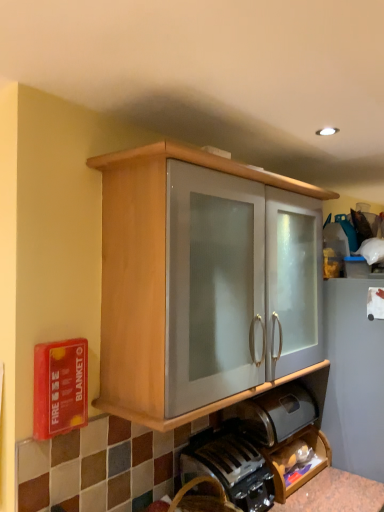
In order to face wooden shelf at lower right, should I rotate leftwards or rightwards?

Rotate right and turn 12.370 degrees.

Locate an element on the screen. Image resolution: width=384 pixels, height=512 pixels. wooden cabinet at center is located at coordinates (148, 278).

Is the position of wooden shelf at lower right more distant than that of black plastic coffee machine at lower center?

Yes, it is.

Considering the sizes of wooden shelf at lower right and black plastic coffee machine at lower center in the image, is wooden shelf at lower right taller or shorter than black plastic coffee machine at lower center?

wooden shelf at lower right is shorter than black plastic coffee machine at lower center.

Looking at their sizes, would you say wooden shelf at lower right is wider or thinner than black plastic coffee machine at lower center?

In the image, wooden shelf at lower right appears to be more narrow than black plastic coffee machine at lower center.

Consider the image. From the image's perspective, is wooden shelf at lower right over black plastic coffee machine at lower center?

No, from the image's perspective, wooden shelf at lower right is not over black plastic coffee machine at lower center.

From the image's perspective, is satin silver bread bin at lower center under wooden shelf at lower right?

No, from the image's perspective, satin silver bread bin at lower center is not below wooden shelf at lower right.

Does satin silver bread bin at lower center have a greater width compared to wooden shelf at lower right?

Yes.

Would you consider satin silver bread bin at lower center to be distant from wooden shelf at lower right?

No, satin silver bread bin at lower center is not far away from wooden shelf at lower right.

Does black plastic coffee machine at lower center lie behind satin silver bread bin at lower center?

No.

Considering the positions of point (195, 458) and point (264, 426), is point (195, 458) closer or farther from the camera than point (264, 426)?

Clearly, point (195, 458) is closer to the camera than point (264, 426).

How different are the orientations of wooden shelf at lower right and wooden cabinet at center in degrees?

0.513 degrees.

Considering the points (322, 441) and (130, 234), which point is in front, point (322, 441) or point (130, 234)?

The point (130, 234) is more forward.

Visually, is wooden shelf at lower right positioned to the left or to the right of wooden cabinet at center?

Clearly, wooden shelf at lower right is on the right of wooden cabinet at center in the image.

Is wooden shelf at lower right completely or partially outside of wooden cabinet at center?

Absolutely, wooden shelf at lower right is external to wooden cabinet at center.

Does satin silver bread bin at lower center appear on the right side of black plastic coffee machine at lower center?

Yes, satin silver bread bin at lower center is to the right of black plastic coffee machine at lower center.

Is satin silver bread bin at lower center shorter than black plastic coffee machine at lower center?

Indeed, satin silver bread bin at lower center has a lesser height compared to black plastic coffee machine at lower center.

From a real-world perspective, which is physically above, satin silver bread bin at lower center or black plastic coffee machine at lower center?

In real-world perspective, satin silver bread bin at lower center is above.

The height and width of the screenshot is (512, 384). What are the coordinates of `appliance located above the black plastic coffee machine at lower center (from the image's perspective)` in the screenshot? It's located at (274, 413).

In the scene shown: Is the depth of wooden cabinet at center greater than that of satin silver bread bin at lower center?

No, the depth of wooden cabinet at center is less than that of satin silver bread bin at lower center.

From the image's perspective, is wooden cabinet at center above or below satin silver bread bin at lower center?

wooden cabinet at center is situated higher than satin silver bread bin at lower center in the image.

Is wooden cabinet at center surrounding satin silver bread bin at lower center?

No, satin silver bread bin at lower center is not inside wooden cabinet at center.

Can you confirm if wooden cabinet at center is positioned to the right of satin silver bread bin at lower center?

No, wooden cabinet at center is not to the right of satin silver bread bin at lower center.

At what (x,y) coordinates should I click in order to perform the action: click on cabinetry on the left of the wooden shelf at lower right. Please return your answer as a coordinate pair (x, y). Looking at the image, I should click on (148, 278).

Measure the distance between wooden cabinet at center and wooden shelf at lower right.

wooden cabinet at center is 28.47 inches from wooden shelf at lower right.

From a real-world perspective, is wooden cabinet at center on wooden shelf at lower right?

Yes, from a real-world perspective, wooden cabinet at center is above wooden shelf at lower right.

Can you tell me how much wooden cabinet at center and wooden shelf at lower right differ in facing direction?

wooden cabinet at center and wooden shelf at lower right are facing 0.513 degrees away from each other.

Identify the location of shelf below the black plastic coffee machine at lower center (from the image's perspective). The image size is (384, 512). (297, 460).

Locate an element on the screen. The image size is (384, 512). appliance located behind the wooden shelf at lower right is located at coordinates (274, 413).

In the scene shown: From the image, which object appears to be farther from wooden cabinet at center, black plastic coffee machine at lower center or wooden shelf at lower right?

wooden shelf at lower right lies further to wooden cabinet at center than the other object.

Looking at the image, which one is located closer to wooden cabinet at center, wooden shelf at lower right or satin silver bread bin at lower center?

The object closer to wooden cabinet at center is satin silver bread bin at lower center.

Looking at this image, looking at the image, which one is located further to black plastic coffee machine at lower center, wooden cabinet at center or satin silver bread bin at lower center?

wooden cabinet at center lies further to black plastic coffee machine at lower center than the other object.

Looking at this image, looking at the image, which one is located further to black plastic coffee machine at lower center, satin silver bread bin at lower center or wooden shelf at lower right?

satin silver bread bin at lower center.

When comparing their distances from wooden shelf at lower right, does black plastic coffee machine at lower center or satin silver bread bin at lower center seem further?

The object further to wooden shelf at lower right is black plastic coffee machine at lower center.

Looking at the image, which one is located further to black plastic coffee machine at lower center, satin silver bread bin at lower center or wooden cabinet at center?

The object further to black plastic coffee machine at lower center is wooden cabinet at center.

Considering their positions, is wooden shelf at lower right positioned closer to satin silver bread bin at lower center than black plastic coffee machine at lower center?

Based on the image, wooden shelf at lower right appears to be nearer to satin silver bread bin at lower center.

Considering their positions, is satin silver bread bin at lower center positioned closer to wooden shelf at lower right than wooden cabinet at center?

satin silver bread bin at lower center lies closer to wooden shelf at lower right than the other object.

Locate an element on the screen. appliance between wooden cabinet at center and wooden shelf at lower right in the up-down direction is located at coordinates (274, 413).

Where is `appliance between black plastic coffee machine at lower center and wooden shelf at lower right in the horizontal direction`? appliance between black plastic coffee machine at lower center and wooden shelf at lower right in the horizontal direction is located at coordinates (274, 413).

Image resolution: width=384 pixels, height=512 pixels. What are the coordinates of `coffee machine between wooden cabinet at center and wooden shelf at lower right vertically` in the screenshot? It's located at (230, 467).

Find the location of a particular element. This screenshot has height=512, width=384. appliance between wooden cabinet at center and black plastic coffee machine at lower center in the up-down direction is located at coordinates (274, 413).